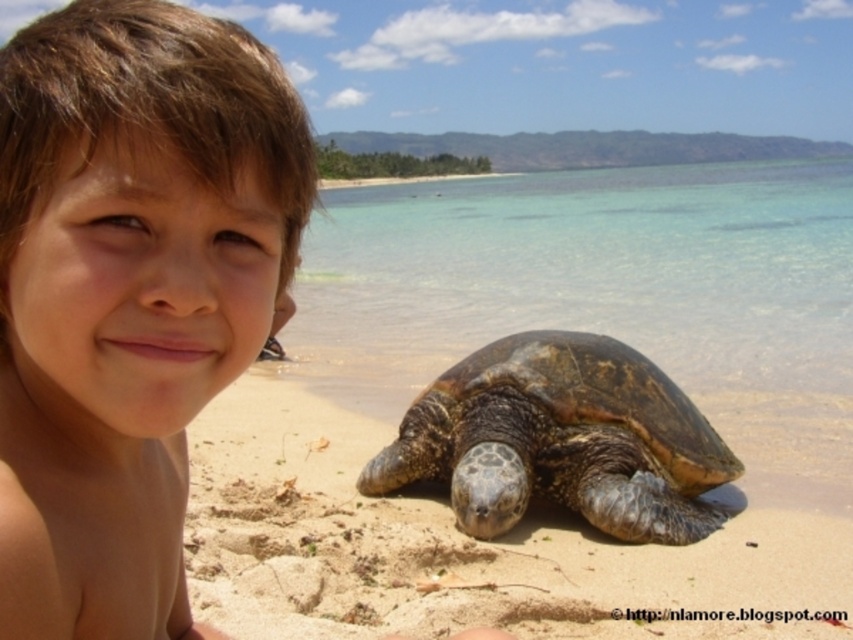
Is smooth skin child at center thinner than brown sandy beach at lower center?

Yes, smooth skin child at center is thinner than brown sandy beach at lower center.

Who is more distant from viewer, (80, 344) or (405, 596)?

Point (405, 596)

Find the location of `smooth skin child at center`. smooth skin child at center is located at coordinates coord(129,292).

Does smooth skin child at center appear on the left side of dark brown textured tortoise at lower center?

Yes, smooth skin child at center is to the left of dark brown textured tortoise at lower center.

Does smooth skin child at center come in front of dark brown textured tortoise at lower center?

Yes.

Which is in front, point (25, 330) or point (573, 390)?

Point (25, 330) is more forward.

Image resolution: width=853 pixels, height=640 pixels. Find the location of `smooth skin child at center`. smooth skin child at center is located at coordinates (129, 292).

Is brown sandy beach at lower center below dark brown textured tortoise at lower center?

Indeed, brown sandy beach at lower center is positioned under dark brown textured tortoise at lower center.

Which is behind, point (659, 561) or point (602, 372)?

Positioned behind is point (602, 372).

Locate an element on the screen. This screenshot has height=640, width=853. brown sandy beach at lower center is located at coordinates (462, 547).